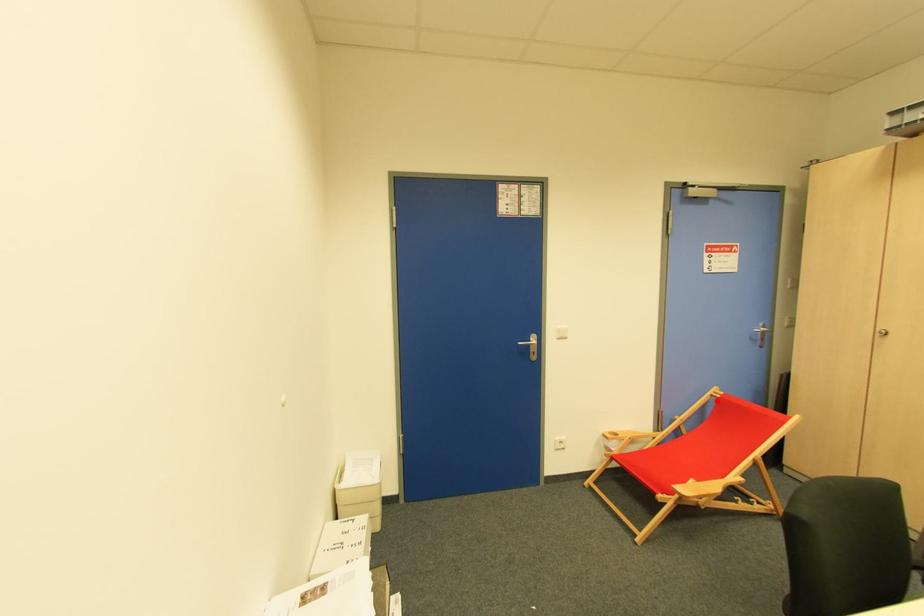
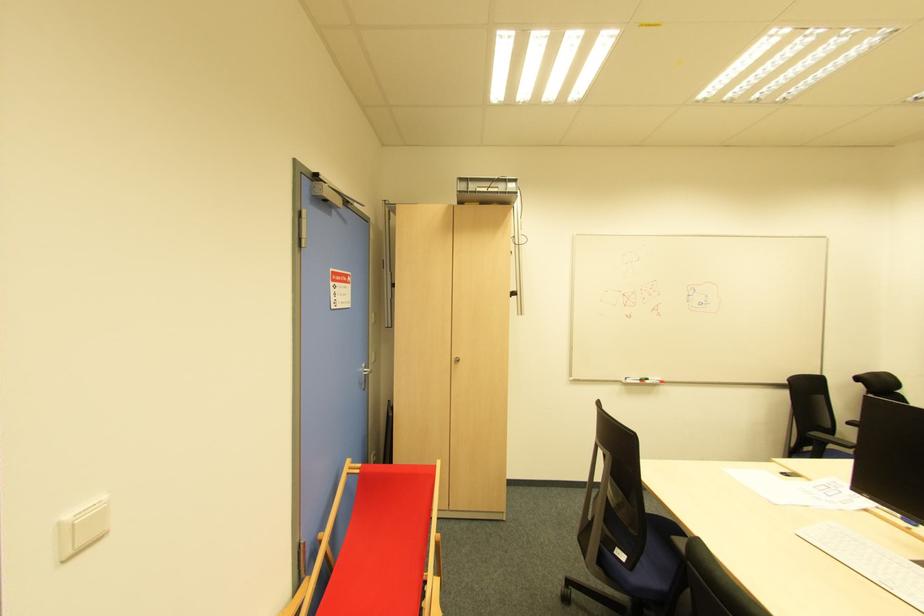
Find the pixel in the second image that matches the highlighted location in the first image.

(357, 477)